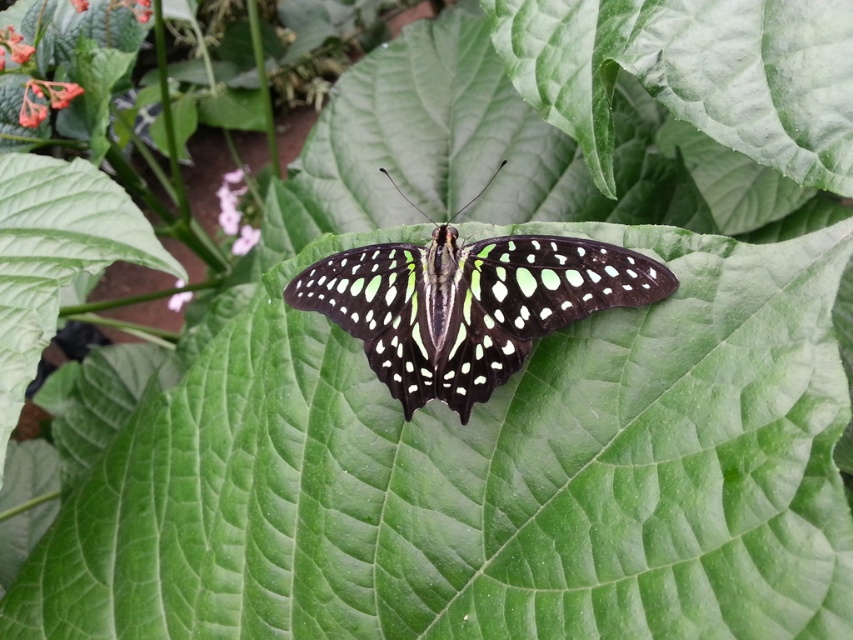
You are a bee trying to collect nectar. You are currently at the matte purple flower at upper left and want to reach the green glossy butterfly at center to get more nectar. Can you fly directly to it without any obstacles?

The distance between the matte purple flower at upper left and green glossy butterfly at center is 3.58 feet, so yes, you can fly directly to it without any obstacles since there are no mentioned obstacles in the scene.